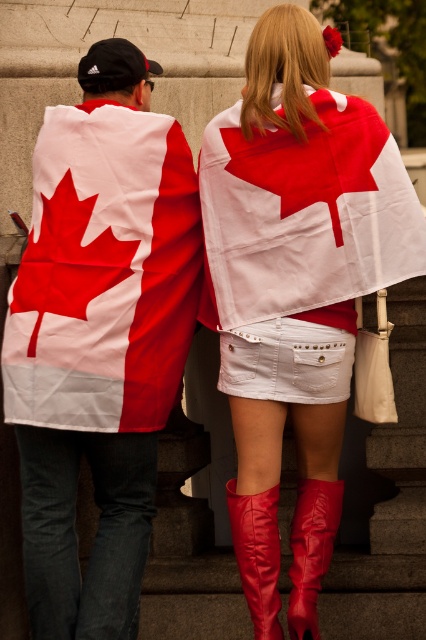
Question: Which point is closer to the camera?

Choices:
 (A) red leather boot at lower center
 (B) white denim skirt at center
 (C) shiny leather boot at lower center

Answer: (A)

Question: Which is nearer to the red leather boot at lower center?

Choices:
 (A) matte white denim skirt at center
 (B) shiny leather boot at lower center

Answer: (B)

Question: Which of the following is the closest to the observer?

Choices:
 (A) matte fabric flag at center
 (B) matte white denim skirt at center
 (C) shiny leather boot at lower center

Answer: (C)

Question: Is shiny leather boot at lower center below red leather boot at lower center?

Choices:
 (A) no
 (B) yes

Answer: (B)

Question: Does white denim skirt at center have a lesser width compared to red leather boot at lower center?

Choices:
 (A) no
 (B) yes

Answer: (A)

Question: Is white fabric flag at center thinner than red leather boot at lower center?

Choices:
 (A) no
 (B) yes

Answer: (B)